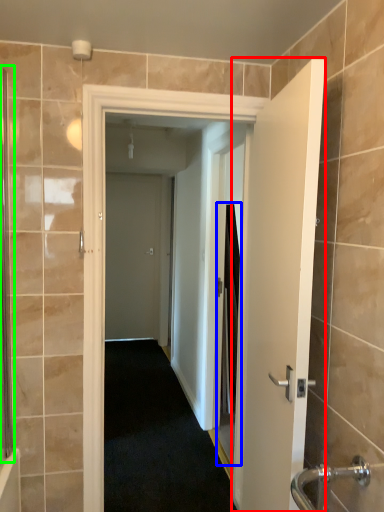
Question: Based on their relative distances, which object is farther from door (highlighted by a red box)? Choose from screen door (highlighted by a blue box) and screen door (highlighted by a green box).

Choices:
 (A) screen door
 (B) screen door

Answer: (A)